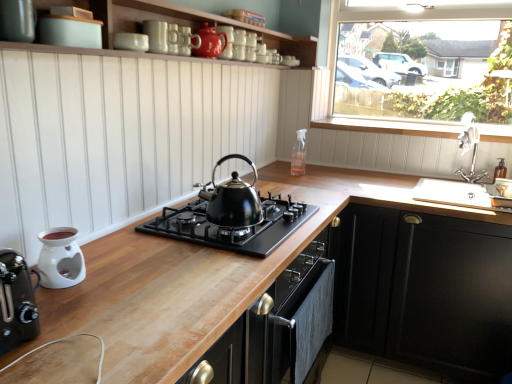
Question: In the image, is transparent glass window at upper right positioned in front of or behind black matte gas stove at center?

Choices:
 (A) behind
 (B) front

Answer: (A)

Question: Considering the positions of transparent glass window at upper right and black matte gas stove at center in the image, is transparent glass window at upper right taller or shorter than black matte gas stove at center?

Choices:
 (A) tall
 (B) short

Answer: (A)

Question: Which of these objects is positioned farthest from the transparent glass window at upper right?

Choices:
 (A) glossy ceramic teapot at upper center, acting as the 3th appliance starting from the front
 (B) white glossy oil burner at lower left, which is the 4th appliance in top-to-bottom order
 (C) black matte cabinet at lower right
 (D) matte white toaster at upper left
 (E) black matte gas stove at center

Answer: (B)

Question: Estimate the real-world distances between objects in this image. Which object is farther from the clear glass spray bottle at upper center, which ranks as the fourth appliance in left-to-right order?

Choices:
 (A) matte white toaster at upper left
 (B) silver metallic faucet at upper right
 (C) wooden at center
 (D) white matte wood shelf at upper center
 (E) white glossy mug at upper center, acting as the 2th appliance starting from the top

Answer: (A)